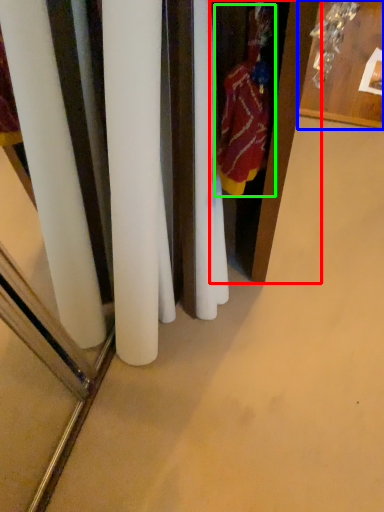
Question: Which is nearer to the armoire (highlighted by a red box)? furniture (highlighted by a blue box) or clothing (highlighted by a green box).

Choices:
 (A) furniture
 (B) clothing

Answer: (B)